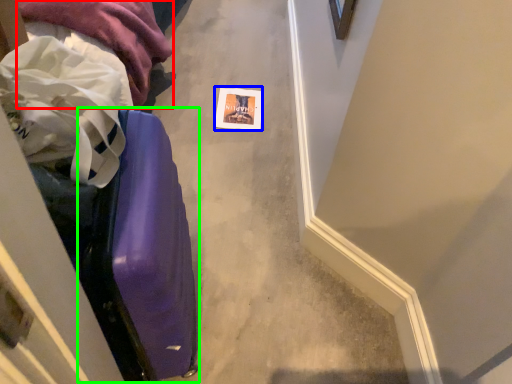
Question: Estimate the real-world distances between objects in this image. Which object is farther from clothing (highlighted by a red box), postcard (highlighted by a blue box) or luggage (highlighted by a green box)?

Choices:
 (A) postcard
 (B) luggage

Answer: (B)